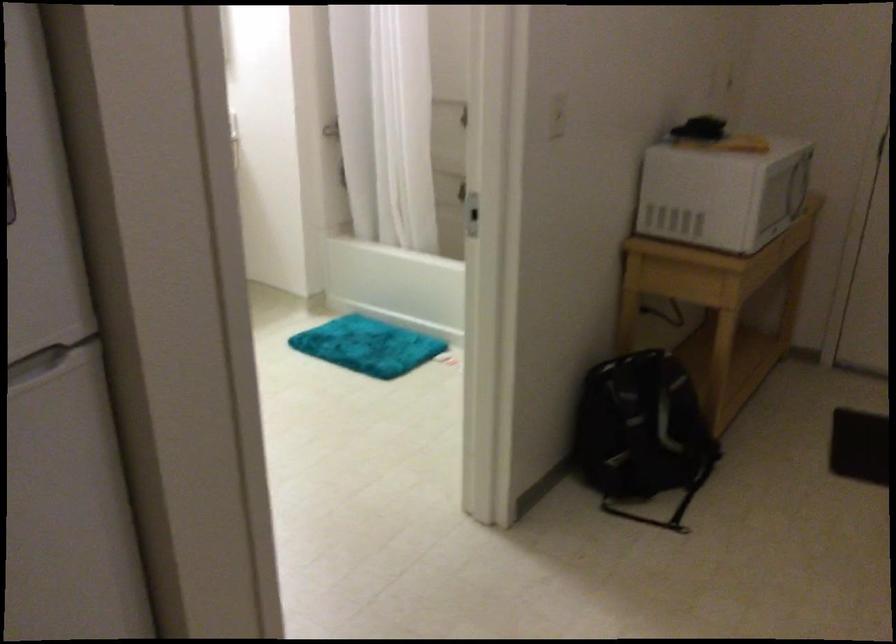
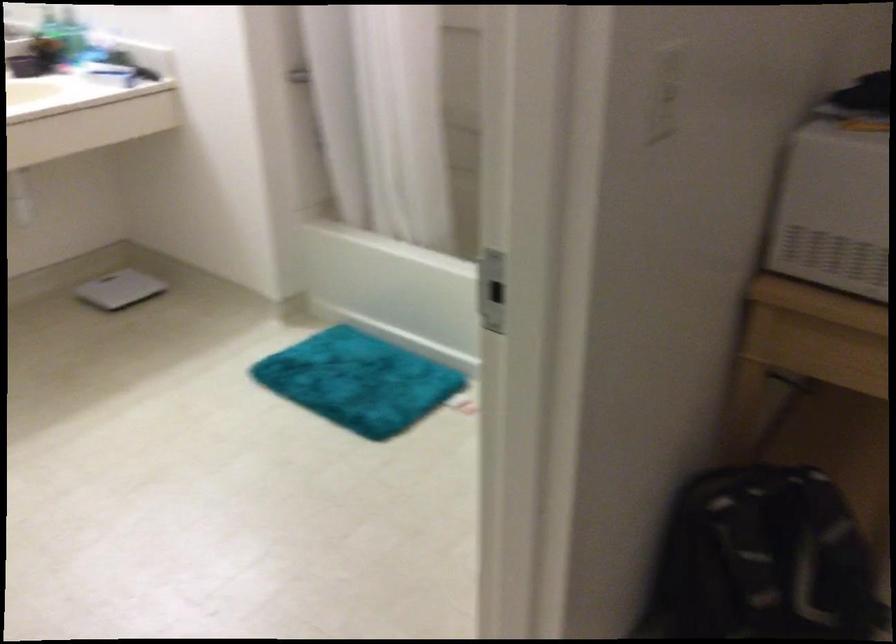
Question: The images are taken continuously from a first-person perspective. In which direction are you moving?

Choices:
 (A) Left
 (B) Right
 (C) Forward
 (D) Backward

Answer: (C)